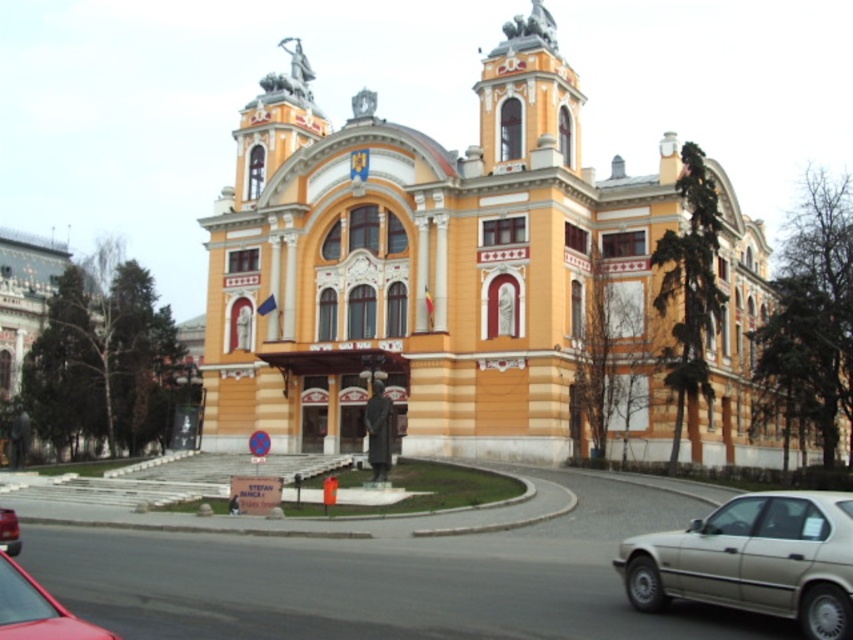
From the picture: You are standing in front of the grand building and want to reach the point marked at coordinates point (x=779, y=586). If your walking speed is 1.2 meters per second, how many seconds will it take you to reach that point?

The point (x=779, y=586) is 27.68 meters away from the viewer. At a walking speed of 1.2 meters per second, it will take approximately 23.07 seconds to reach the point.

You are standing in front of the grand building and see a silver metallic sedan at lower right. What is the purpose of the point at coordinates point (753,561)?

The point at coordinates point (753,561) is on the silver metallic sedan at lower right, indicating its location on the vehicle.

You are standing at the entrance of the grand building. You notice two points marked on the ground in front of you. The first point is at coordinate point (x=473, y=179) and the second is at point (x=10, y=515). If you want to walk towards the point that is further away from you, which coordinate should you head towards?

Point (x=473, y=179) is behind point (x=10, y=515), so you should head towards point (x=473, y=179) as it is further away from your current position at the entrance.